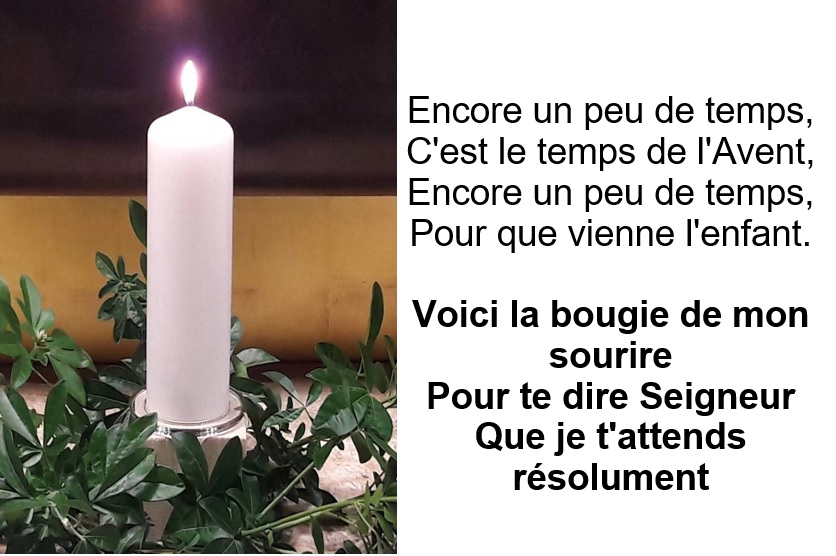
You are a GUI agent. You are given a task and a screenshot of the screen. Output one action in this format:
    pyautogui.click(x=<x>, y=<y>)
    Task: Click on the candle light
    The height and width of the screenshot is (556, 836).
    Given the screenshot: What is the action you would take?
    pyautogui.click(x=192, y=75)